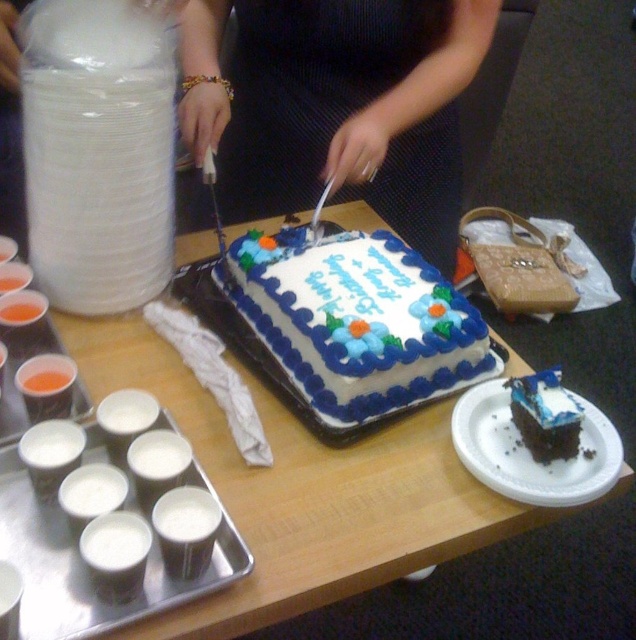
Looking at this image, you are planning to place a birthday card on the table in the image. The card is 10 cm wide. Where should you place it so that it doesn not overlap with the matte black dress at center?

The matte black dress at center is located at point (336, 106). To avoid overlapping, place the card away from this coordinate, such as near the tray with cups or the stack of plates on the left side of the table.

You are planning to serve both the white cardboard cake at center and the chocolate cake at center at a party. Which cake has a larger surface area for placing decorations?

A: The white cardboard cake at center has a larger surface area for placing decorations because its width is greater than the chocolate cake at center.